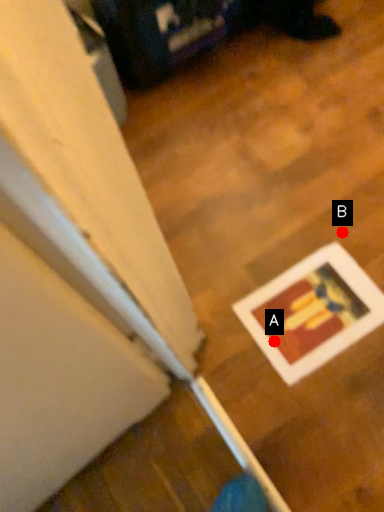
Question: Two points are circled on the image, labeled by A and B beside each circle. Which point is closer to the camera?

Choices:
 (A) A is closer
 (B) B is closer

Answer: (A)